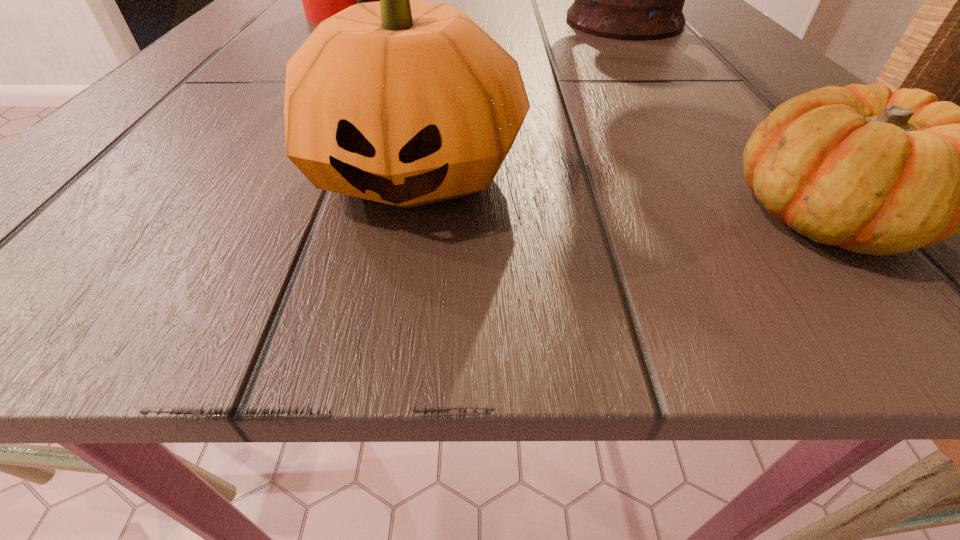
Where is `vacant position at the left edge of the desktop`? The height and width of the screenshot is (540, 960). vacant position at the left edge of the desktop is located at coordinates (241, 42).

Locate an element on the screen. vacant space at the right edge of the desktop is located at coordinates click(752, 94).

This screenshot has height=540, width=960. I want to click on the third closest object to the fire extinguisher, so click(x=876, y=172).

Image resolution: width=960 pixels, height=540 pixels. Find the location of `the closest object to the shortest object`. the closest object to the shortest object is located at coordinates (404, 102).